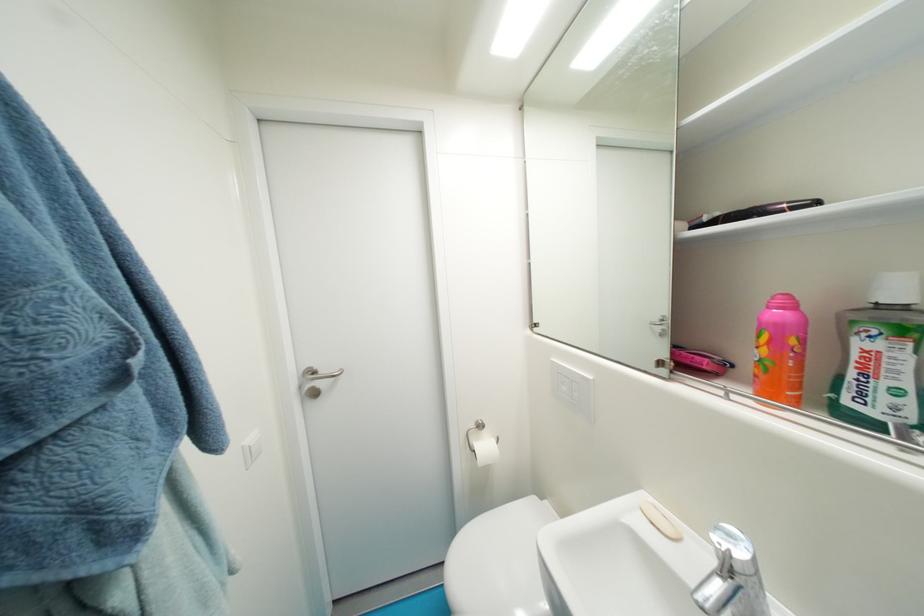
Identify the location of metal door handle. This screenshot has width=924, height=616. tap(319, 374).